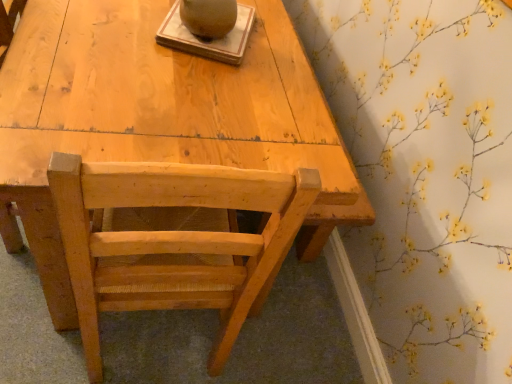
Describe the element at coordinates (159, 116) in the screenshot. This screenshot has width=512, height=384. I see `natural wood table at center` at that location.

You are a GUI agent. You are given a task and a screenshot of the screen. Output one action in this format:
    pyautogui.click(x=<x>, y=<y>)
    Task: Click on the natural wood table at center
    Image resolution: width=512 pixels, height=384 pixels.
    Given the screenshot: What is the action you would take?
    pyautogui.click(x=159, y=116)

This screenshot has width=512, height=384. Identify the location of natural wood table at center. (159, 116).